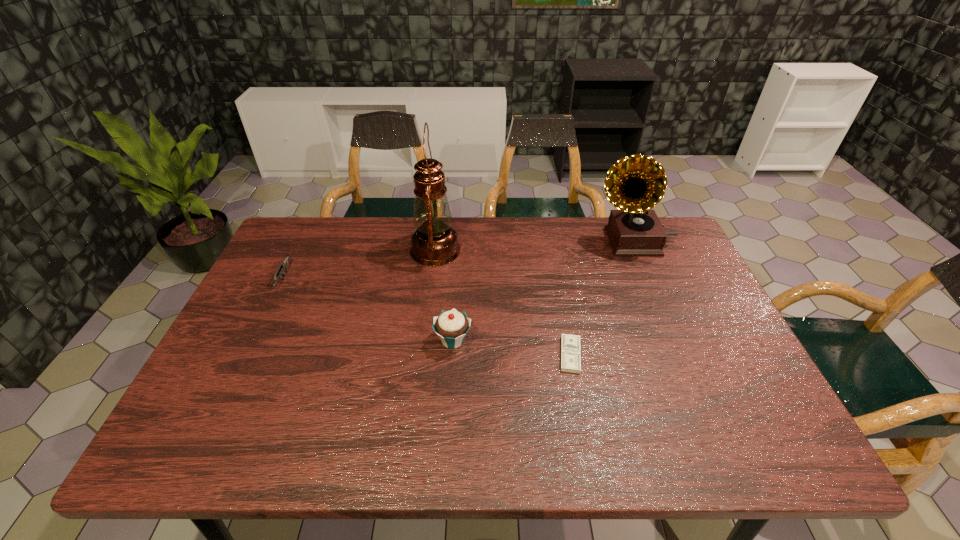
The width and height of the screenshot is (960, 540). What are the coordinates of `vacant space situated from the horn of the second tallest object` in the screenshot? It's located at (509, 241).

This screenshot has height=540, width=960. Identify the location of free space located from the horn of the second tallest object. (537, 241).

What are the coordinates of `vacant area located on the left of the third tallest object` in the screenshot? It's located at (368, 340).

The width and height of the screenshot is (960, 540). I want to click on vacant space located 0.350m aimed along the barrel of the second shortest object, so click(221, 407).

Locate an element on the screen. free space located 0.360m on the back of the second object from right to left is located at coordinates (550, 251).

At what (x,y) coordinates should I click in order to perform the action: click on oil lamp that is at the far edge. Please return your answer as a coordinate pair (x, y). Looking at the image, I should click on (434, 242).

Locate an element on the screen. This screenshot has width=960, height=540. phonograph record at the far edge is located at coordinates (635, 184).

At what (x,y) coordinates should I click in order to perform the action: click on object that is at the left edge. Please return your answer as a coordinate pair (x, y). This screenshot has height=540, width=960. Looking at the image, I should click on (284, 265).

Identify the location of object present at the right edge. The image size is (960, 540). (635, 184).

At what (x,y) coordinates should I click in order to perform the action: click on object that is at the far right corner. Please return your answer as a coordinate pair (x, y). The image size is (960, 540). Looking at the image, I should click on (635, 184).